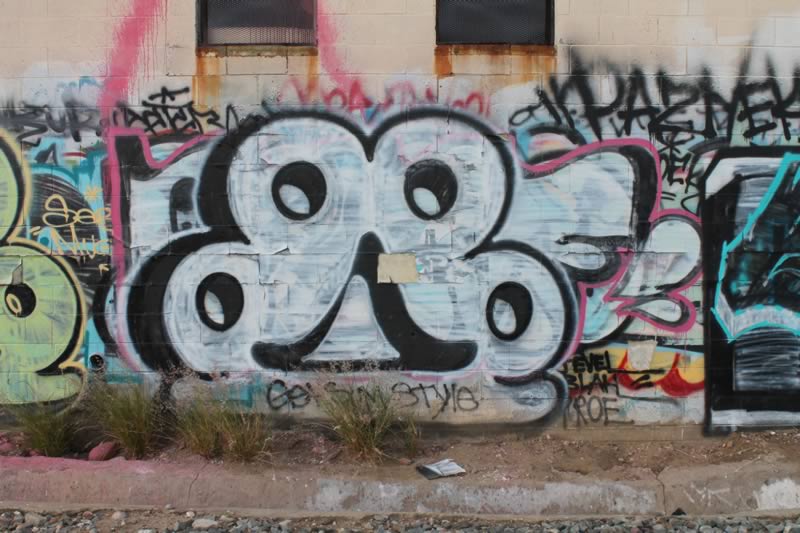
Where is `floor`? floor is located at coordinates (508, 484).